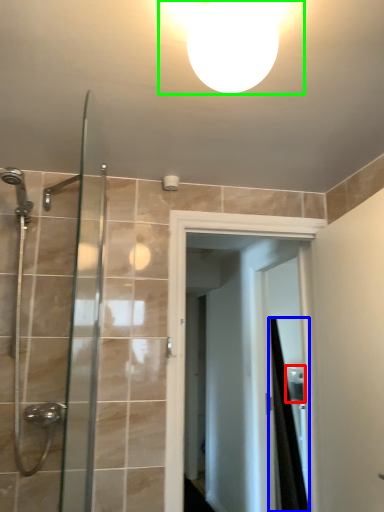
Question: Which object is the closest to the sink (highlighted by a red box)? Choose among these: shower curtain (highlighted by a blue box) or light fixture (highlighted by a green box).

Choices:
 (A) shower curtain
 (B) light fixture

Answer: (A)